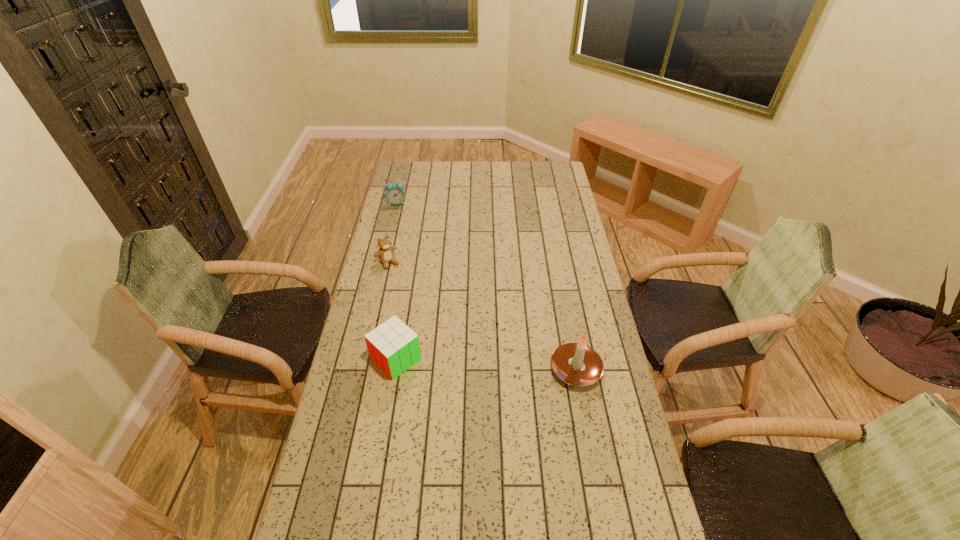
Locate an element on the screen. The image size is (960, 540). free spot on the desktop that is between the cube and the candle and is positioned on the front-facing side of the teddy bear is located at coordinates (466, 363).

Where is `free space on the desktop that is between the cube and the rightmost object and is positioned on the face of the alarm clock`? Image resolution: width=960 pixels, height=540 pixels. free space on the desktop that is between the cube and the rightmost object and is positioned on the face of the alarm clock is located at coordinates (464, 363).